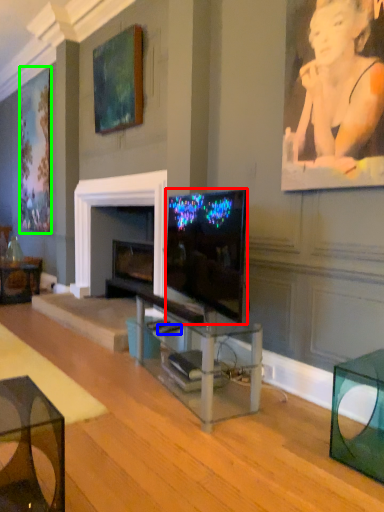
Question: Estimate the real-world distances between objects in this image. Which object is farther from television (highlighted by a red box), remote control (highlighted by a blue box) or picture frame (highlighted by a green box)?

Choices:
 (A) remote control
 (B) picture frame

Answer: (B)